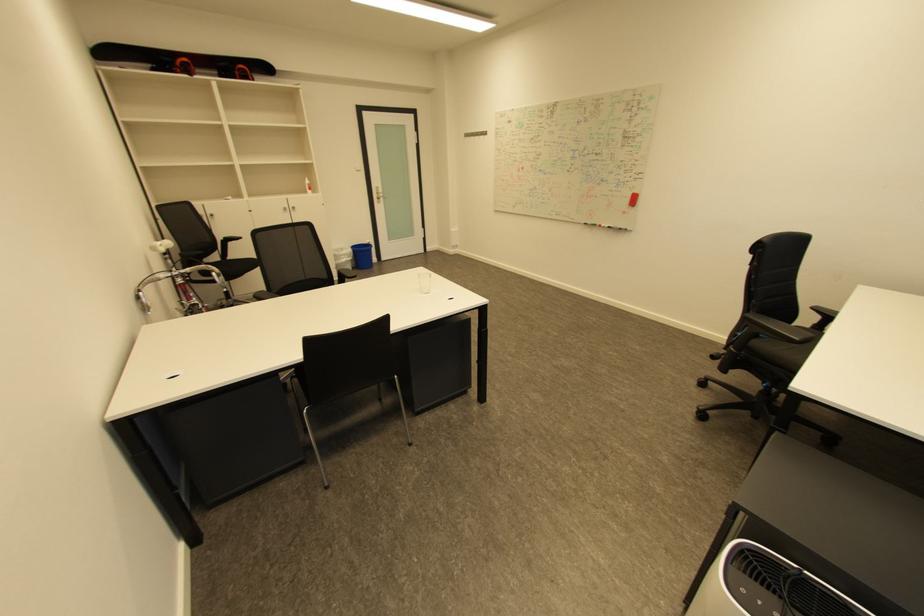
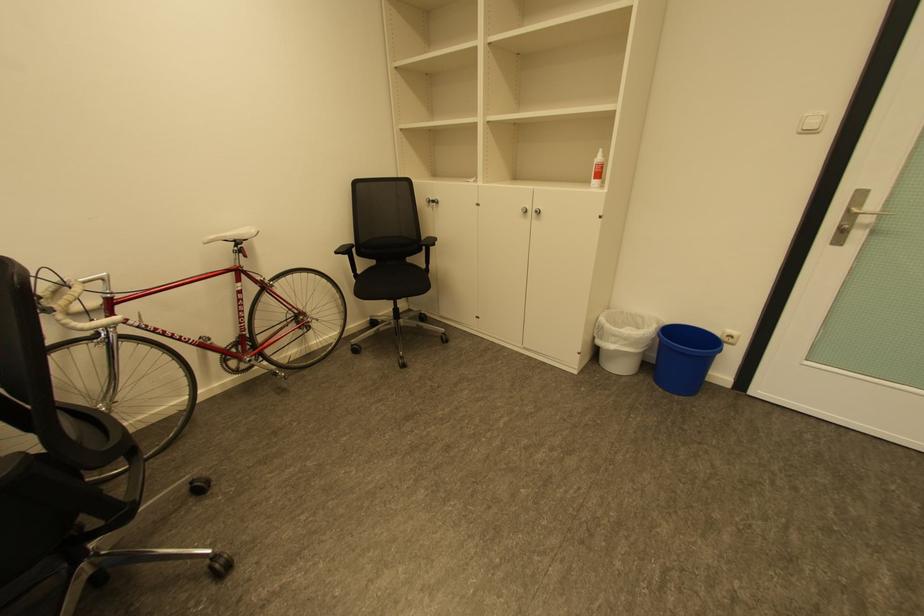
Find the pixel in the second image that matches point 349,256 in the first image.

(622, 337)